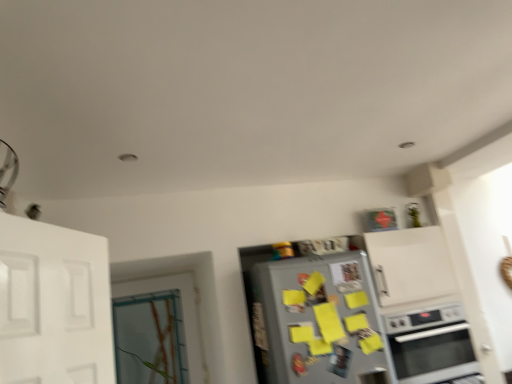
The height and width of the screenshot is (384, 512). Describe the element at coordinates (157, 329) in the screenshot. I see `clear glass door at left` at that location.

Identify the location of clear glass door at left. This screenshot has height=384, width=512. 157,329.

I want to click on satin silver oven at lower right, so click(x=431, y=344).

Who is smaller, silver metallic refrigerator at center or clear glass door at left?

clear glass door at left.

From a real-world perspective, who is located lower, silver metallic refrigerator at center or clear glass door at left?

silver metallic refrigerator at center, from a real-world perspective.

Can clear glass door at left be found inside silver metallic refrigerator at center?

Actually, clear glass door at left is outside silver metallic refrigerator at center.

From the image's perspective, which one is positioned higher, clear glass door at left or satin silver oven at lower right?

clear glass door at left appears higher in the image.

Would you say clear glass door at left is to the left or to the right of satin silver oven at lower right in the picture?

From the image, it's evident that clear glass door at left is to the left of satin silver oven at lower right.

Based on the photo, from a real-world perspective, is clear glass door at left positioned under satin silver oven at lower right based on gravity?

No, from a real-world perspective, clear glass door at left is not below satin silver oven at lower right.

Is clear glass door at left inside or outside of satin silver oven at lower right?

clear glass door at left is spatially situated outside satin silver oven at lower right.

Are satin silver oven at lower right and silver metallic refrigerator at center far apart?

No, satin silver oven at lower right is not far from silver metallic refrigerator at center.

Considering the positions of objects satin silver oven at lower right and silver metallic refrigerator at center in the image provided, who is in front, satin silver oven at lower right or silver metallic refrigerator at center?

silver metallic refrigerator at center is more forward.

From the image's perspective, between satin silver oven at lower right and silver metallic refrigerator at center, which one is located above?

silver metallic refrigerator at center.

Which of these two, satin silver oven at lower right or silver metallic refrigerator at center, stands shorter?

satin silver oven at lower right.

In terms of width, does satin silver oven at lower right look wider or thinner when compared to clear glass door at left?

In the image, satin silver oven at lower right appears to be wider than clear glass door at left.

Based on the photo, which is in front, satin silver oven at lower right or clear glass door at left?

satin silver oven at lower right is closer to the camera.

Between satin silver oven at lower right and clear glass door at left, which one has more height?

clear glass door at left.

From a real-world perspective, is satin silver oven at lower right positioned above or below clear glass door at left?

From a real-world perspective, satin silver oven at lower right is physically below clear glass door at left.

Can you confirm if silver metallic refrigerator at center is thinner than satin silver oven at lower right?

Correct, the width of silver metallic refrigerator at center is less than that of satin silver oven at lower right.

What's the angular difference between silver metallic refrigerator at center and satin silver oven at lower right's facing directions?

0.5 degrees separate the facing orientations of silver metallic refrigerator at center and satin silver oven at lower right.

How distant is silver metallic refrigerator at center from satin silver oven at lower right?

17.03 inches.

Considering their positions, is silver metallic refrigerator at center located in front of or behind satin silver oven at lower right?

In the image, silver metallic refrigerator at center appears in front of satin silver oven at lower right.

Where is `refrigerator in front of the clear glass door at left`? refrigerator in front of the clear glass door at left is located at coordinates (318, 320).

Which object is more forward, clear glass door at left or silver metallic refrigerator at center?

silver metallic refrigerator at center is closer to the camera.

Is clear glass door at left completely or partially outside of silver metallic refrigerator at center?

Yes.

Does point (168, 333) come in front of point (267, 326)?

No, (168, 333) is further to viewer.

At what (x,y) coordinates should I click in order to perform the action: click on door above the silver metallic refrigerator at center (from a real-world perspective). Please return your answer as a coordinate pair (x, y). Looking at the image, I should click on (157, 329).

Where is `oven located below the clear glass door at left (from the image's perspective)`? oven located below the clear glass door at left (from the image's perspective) is located at coordinates (431, 344).

Estimate the real-world distances between objects in this image. Which object is further from clear glass door at left, satin silver oven at lower right or silver metallic refrigerator at center?

Based on the image, satin silver oven at lower right appears to be further to clear glass door at left.

From the image, which object appears to be nearer to silver metallic refrigerator at center, satin silver oven at lower right or clear glass door at left?

satin silver oven at lower right is closer to silver metallic refrigerator at center.

Considering their positions, is clear glass door at left positioned closer to silver metallic refrigerator at center than satin silver oven at lower right?

satin silver oven at lower right is positioned closer to the anchor silver metallic refrigerator at center.

When comparing their distances from clear glass door at left, does silver metallic refrigerator at center or satin silver oven at lower right seem further?

Among the two, satin silver oven at lower right is located further to clear glass door at left.

Which object lies further to the anchor point satin silver oven at lower right, clear glass door at left or silver metallic refrigerator at center?

Among the two, clear glass door at left is located further to satin silver oven at lower right.

Estimate the real-world distances between objects in this image. Which object is closer to satin silver oven at lower right, silver metallic refrigerator at center or clear glass door at left?

Among the two, silver metallic refrigerator at center is located nearer to satin silver oven at lower right.

Image resolution: width=512 pixels, height=384 pixels. In order to click on refrigerator situated between clear glass door at left and satin silver oven at lower right from left to right in this screenshot , I will do `click(318, 320)`.